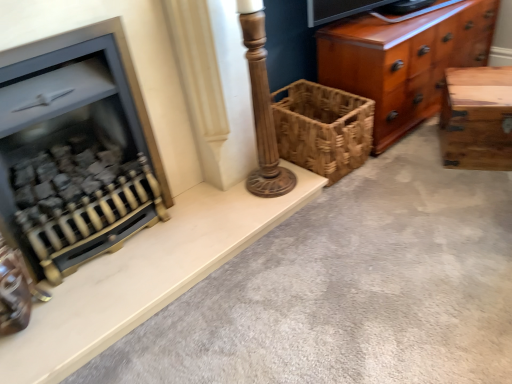
The width and height of the screenshot is (512, 384). Identify the location of empty space that is in between natural wood trunk at right and woven brown basket at center. [x=410, y=157].